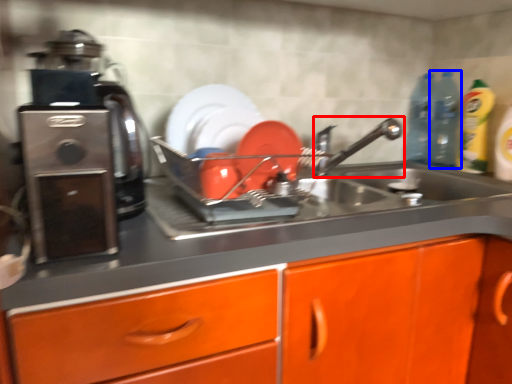
Question: Which object appears closest to the camera in this image, tap (highlighted by a red box) or bottle (highlighted by a blue box)?

Choices:
 (A) tap
 (B) bottle

Answer: (A)